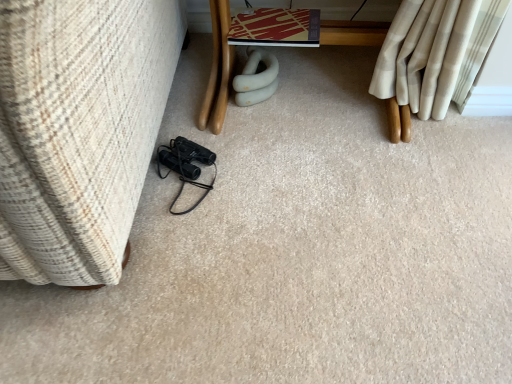
Question: Should I look upward or downward to see wooden table at center?

Choices:
 (A) up
 (B) down

Answer: (A)